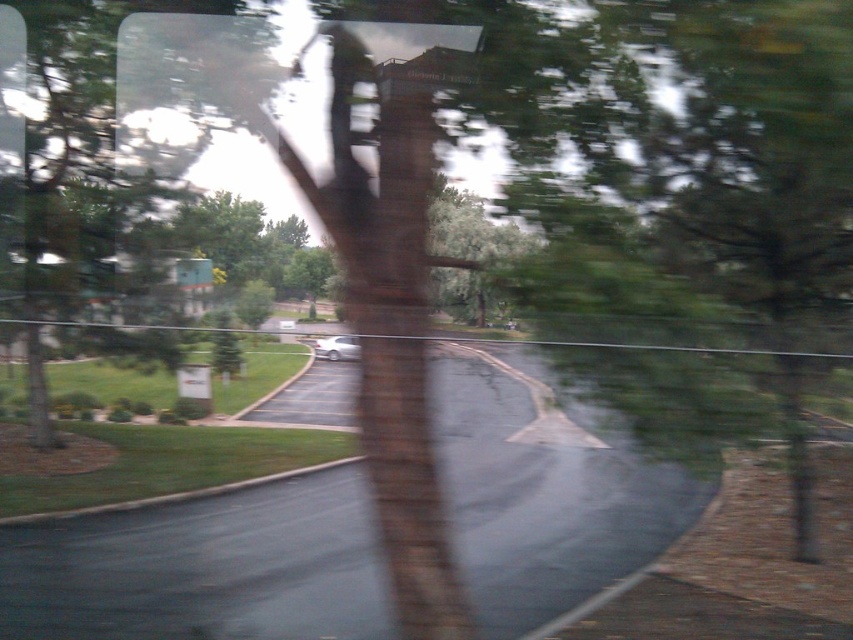
Question: Which point is farther to the camera?

Choices:
 (A) (461, 301)
 (B) (323, 337)

Answer: (A)

Question: Which point is farther to the camera?

Choices:
 (A) satin silver car at center
 (B) green leafy tree at center

Answer: (B)

Question: Is green leafy tree at center to the right of satin silver car at center from the viewer's perspective?

Choices:
 (A) no
 (B) yes

Answer: (B)

Question: Does green leafy tree at center appear on the left side of satin silver car at center?

Choices:
 (A) yes
 (B) no

Answer: (B)

Question: Can you confirm if green leafy tree at center is positioned to the left of satin silver car at center?

Choices:
 (A) no
 (B) yes

Answer: (A)